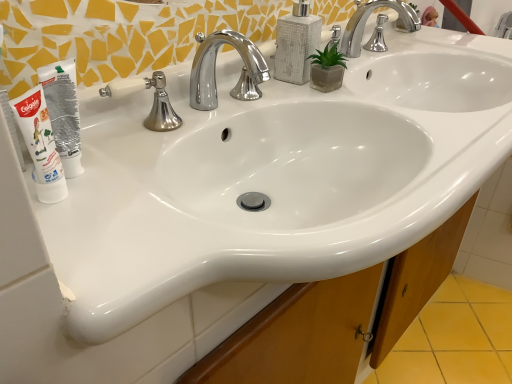
Looking at this image, what is the approximate width of silver/chrome faucet at center?

It is 2.38 inches.

What is the approximate width of polished chrome faucet at center, the second tap positioned from the right?

The width of polished chrome faucet at center, the second tap positioned from the right, is 8.22 inches.

Measure the distance between point (350, 20) and camera.

Point (350, 20) and camera are 3.77 feet apart.

What do you see at coordinates (63, 112) in the screenshot? I see `white tube at left` at bounding box center [63, 112].

Where is `silver/chrome faucet at center`? This screenshot has height=384, width=512. silver/chrome faucet at center is located at coordinates (160, 106).

Does white tube at left have a lesser height compared to polished chrome faucet at center, the second tap positioned from the right?

Incorrect, the height of white tube at left does not fall short of that of polished chrome faucet at center, the second tap positioned from the right.

From a real-world perspective, is white tube at left on top of polished chrome faucet at center, which is the first tap in bottom-to-top order?

Yes, from a real-world perspective, white tube at left is over polished chrome faucet at center, which is the first tap in bottom-to-top order

This screenshot has height=384, width=512. Find the location of `mouthwash on the left side of polished chrome faucet at center, the 1th tap in the left-to-right sequence`. mouthwash on the left side of polished chrome faucet at center, the 1th tap in the left-to-right sequence is located at coordinates (63, 112).

In the scene shown: Can you confirm if white tube at left is positioned to the left of polished chrome faucet at center, which is the first tap in bottom-to-top order?

Yes.

From a real-world perspective, is white matte tube at left physically located above or below silver/chrome faucet at center?

white matte tube at left is situated higher than silver/chrome faucet at center in the real world.

Is white matte tube at left positioned beyond the bounds of silver/chrome faucet at center?

That's correct, white matte tube at left is outside of silver/chrome faucet at center.

Is white matte tube at left thinner than silver/chrome faucet at center?

Yes.

From the picture: Who is bigger, white matte tube at left or silver/chrome faucet at center?

silver/chrome faucet at center.

Can you tell me how much silver/chrome faucet at center and white matte tube at left differ in facing direction?

The angle between the facing direction of silver/chrome faucet at center and the facing direction of white matte tube at left is 0.00397 degrees.

Locate an element on the screen. The image size is (512, 384). plumbing fixture behind the white matte tube at left is located at coordinates (160, 106).

Could you tell me if silver/chrome faucet at center is facing white matte tube at left?

No, silver/chrome faucet at center is not aimed at white matte tube at left.

Considering the positions of point (150, 127) and point (60, 191), is point (150, 127) closer or farther from the camera than point (60, 191)?

Point (150, 127) is positioned farther from the camera compared to point (60, 191).

From the image's perspective, between white textured soap dispenser at upper center and white tube at left, which one is located above?

white textured soap dispenser at upper center.

Based on their positions, is white textured soap dispenser at upper center located to the left or right of white tube at left?

Clearly, white textured soap dispenser at upper center is on the right of white tube at left in the image.

Is white textured soap dispenser at upper center closer to camera compared to white tube at left?

No, it is not.

Is white tube at left surrounded by white textured soap dispenser at upper center?

Definitely not — white tube at left is not inside white textured soap dispenser at upper center.

From the image's perspective, which one is positioned higher, silver/chrome faucet at center or polished chrome faucet at center, which is counted as the first tap, starting from the front?

polished chrome faucet at center, which is counted as the first tap, starting from the front, is shown above in the image.

How many degrees apart are the facing directions of silver/chrome faucet at center and polished chrome faucet at center, which is counted as the first tap, starting from the front?

The angle between the facing direction of silver/chrome faucet at center and the facing direction of polished chrome faucet at center, which is counted as the first tap, starting from the front, is 0.00103 degrees.

Is polished chrome faucet at center, which is the first tap in bottom-to-top order, surrounded by silver/chrome faucet at center?

No, polished chrome faucet at center, which is the first tap in bottom-to-top order, is not inside silver/chrome faucet at center.

Find the location of a particular element. This screenshot has width=512, height=384. the 1st tap to the right when counting from the silver/chrome faucet at center is located at coordinates (215, 69).

What's the angular difference between polished chrome faucet at center, the second tap positioned from the right, and silver/chrome faucet at center's facing directions?

The angle between the facing direction of polished chrome faucet at center, the second tap positioned from the right, and the facing direction of silver/chrome faucet at center is 0.00103 degrees.

Is polished chrome faucet at center, which is the first tap in bottom-to-top order, completely or partially outside of silver/chrome faucet at center?

Indeed, polished chrome faucet at center, which is the first tap in bottom-to-top order, is completely outside silver/chrome faucet at center.

Between polished chrome faucet at center, the 2th tap when ordered from back to front, and silver/chrome faucet at center, which one has smaller size?

With smaller size is silver/chrome faucet at center.

From the picture: Is polished chrome faucet at center, the second tap positioned from the right, not close to silver/chrome faucet at center?

polished chrome faucet at center, the second tap positioned from the right, is actually quite close to silver/chrome faucet at center.

Does white textured soap dispenser at upper center turn towards polished chrome faucet at center, the second tap positioned from the right?

No, white textured soap dispenser at upper center is not aimed at polished chrome faucet at center, the second tap positioned from the right.

Is white textured soap dispenser at upper center wider than polished chrome faucet at center, the 2th tap when ordered from back to front?

No, white textured soap dispenser at upper center is not wider than polished chrome faucet at center, the 2th tap when ordered from back to front.

Does point (298, 34) lie in front of point (242, 51)?

Yes, it is.

Considering the relative sizes of white textured soap dispenser at upper center and polished chrome faucet at center, the 2th tap when ordered from back to front, in the image provided, is white textured soap dispenser at upper center smaller than polished chrome faucet at center, the 2th tap when ordered from back to front,?

Yes.

At what (x,y) coordinates should I click in order to perform the action: click on mouthwash that is in front of the polished chrome faucet at center, the second tap positioned from the right. Please return your answer as a coordinate pair (x, y). The width and height of the screenshot is (512, 384). Looking at the image, I should click on (63, 112).

Where is `plumbing fixture behind the white matte tube at left`? plumbing fixture behind the white matte tube at left is located at coordinates (160, 106).

From the image, which object appears to be farther from white textured soap dispenser at upper center, polished chrome faucet at center, the 2th tap when ordered from back to front, or chrome/metallic faucet at upper center, the 2th tap viewed from the left?

chrome/metallic faucet at upper center, the 2th tap viewed from the left, is further to white textured soap dispenser at upper center.

Looking at this image, based on their spatial positions, is white matte tube at left or polished chrome faucet at center, the 2th tap in the top-to-bottom sequence, closer to white textured soap dispenser at upper center?

polished chrome faucet at center, the 2th tap in the top-to-bottom sequence, is closer to white textured soap dispenser at upper center.

Estimate the real-world distances between objects in this image. Which object is further from silver/chrome faucet at center, white tube at left or chrome/metallic faucet at upper center, positioned as the 2th tap in front-to-back order?

Among the two, chrome/metallic faucet at upper center, positioned as the 2th tap in front-to-back order, is located further to silver/chrome faucet at center.

Which object lies further to the anchor point white textured soap dispenser at upper center, white matte tube at left or silver/chrome faucet at center?

white matte tube at left.

Looking at the image, which one is located further to white tube at left, white textured soap dispenser at upper center or polished chrome faucet at center, which is the first tap in bottom-to-top order?

Among the two, white textured soap dispenser at upper center is located further to white tube at left.

When comparing their distances from white tube at left, does chrome/metallic faucet at upper center, marked as the second tap in a bottom-to-top arrangement, or polished chrome faucet at center, the 2th tap in the top-to-bottom sequence, seem further?

chrome/metallic faucet at upper center, marked as the second tap in a bottom-to-top arrangement, is positioned further to the anchor white tube at left.

When comparing their distances from white tube at left, does polished chrome faucet at center, the 2th tap when ordered from back to front, or white textured soap dispenser at upper center seem further?

Based on the image, white textured soap dispenser at upper center appears to be further to white tube at left.

Estimate the real-world distances between objects in this image. Which object is closer to silver/chrome faucet at center, white textured soap dispenser at upper center or chrome/metallic faucet at upper center, which is counted as the first tap, starting from the back?

Based on the image, white textured soap dispenser at upper center appears to be nearer to silver/chrome faucet at center.

Image resolution: width=512 pixels, height=384 pixels. What are the coordinates of `plumbing fixture between white tube at left and polished chrome faucet at center, which is counted as the first tap, starting from the front` in the screenshot? It's located at point(160,106).

Where is `mouthwash positioned between white matte tube at left and silver/chrome faucet at center from near to far`? Image resolution: width=512 pixels, height=384 pixels. mouthwash positioned between white matte tube at left and silver/chrome faucet at center from near to far is located at coordinates (63, 112).

Image resolution: width=512 pixels, height=384 pixels. Identify the location of soap dispenser between silver/chrome faucet at center and chrome/metallic faucet at upper center, the first tap viewed from the right, from left to right. (296, 44).

Image resolution: width=512 pixels, height=384 pixels. What are the coordinates of `soap dispenser situated between white matte tube at left and chrome/metallic faucet at upper center, the 2th tap viewed from the left, from left to right` in the screenshot? It's located at (296, 44).